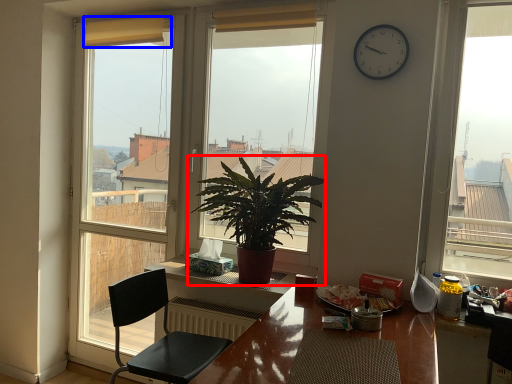
Question: Among these objects, which one is nearest to the camera, houseplant (highlighted by a red box) or curtain (highlighted by a blue box)?

Choices:
 (A) houseplant
 (B) curtain

Answer: (A)